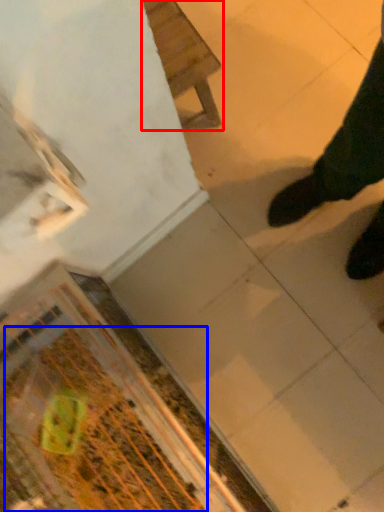
Question: Which object is further to the camera taking this photo, furniture (highlighted by a red box) or debris (highlighted by a blue box)?

Choices:
 (A) furniture
 (B) debris

Answer: (A)